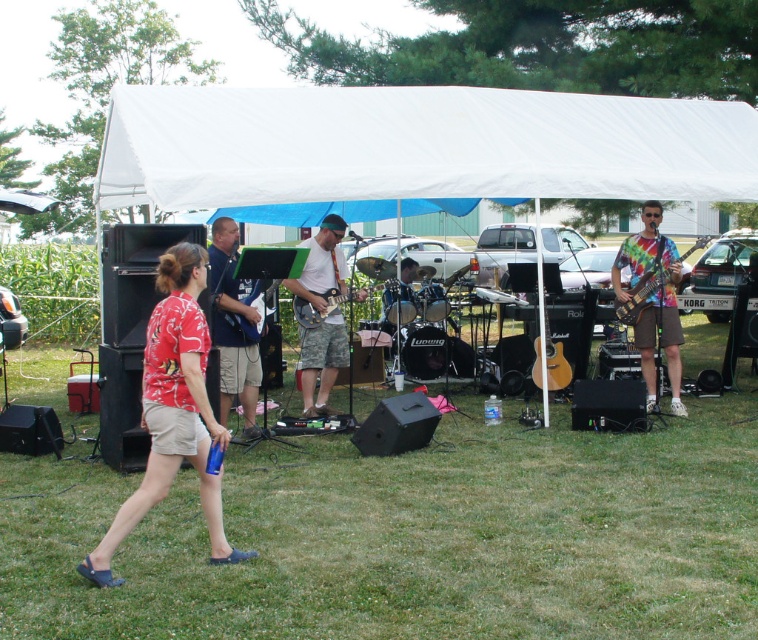
Who is shorter, blue fabric shirt at center or tie-dye fabric bass guitar at right?

Standing shorter between the two is tie-dye fabric bass guitar at right.

Can you confirm if blue fabric shirt at center is positioned to the right of tie-dye fabric bass guitar at right?

In fact, blue fabric shirt at center is to the left of tie-dye fabric bass guitar at right.

Locate an element on the screen. Image resolution: width=758 pixels, height=640 pixels. blue fabric shirt at center is located at coordinates (233, 326).

Who is taller, red floral shirt at lower left or tie-dye fabric guitar at right?

tie-dye fabric guitar at right is taller.

Can you confirm if red floral shirt at lower left is positioned above tie-dye fabric guitar at right?

No, red floral shirt at lower left is not above tie-dye fabric guitar at right.

Is point (149, 419) positioned in front of point (662, 314)?

Yes, point (149, 419) is closer to viewer.

Find the location of `red floral shirt at lower left`. red floral shirt at lower left is located at coordinates (174, 412).

This screenshot has width=758, height=640. Identify the location of white fabric tent at center. (412, 148).

What do you see at coordinates (412, 148) in the screenshot? I see `white fabric tent at center` at bounding box center [412, 148].

Identify the location of white fabric tent at center. The image size is (758, 640). (412, 148).